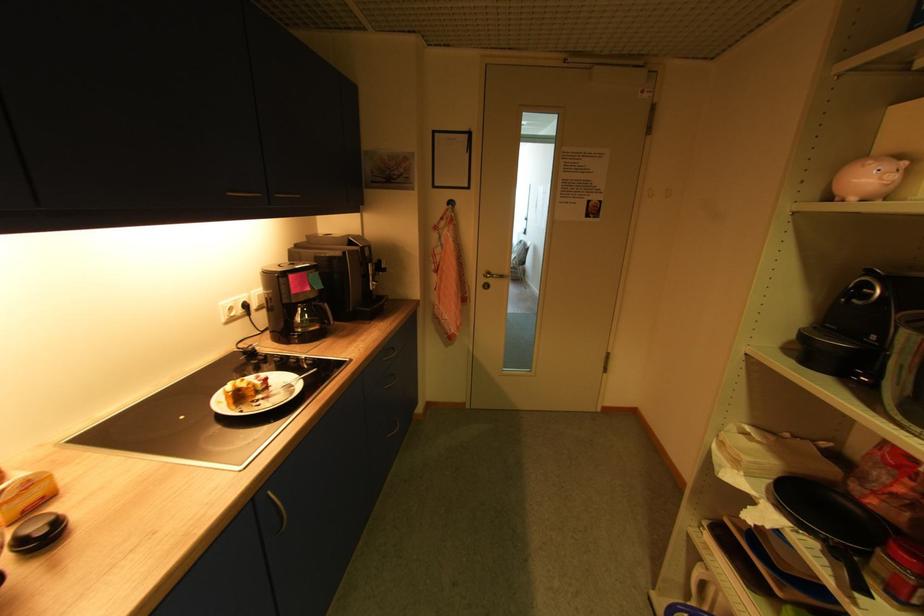
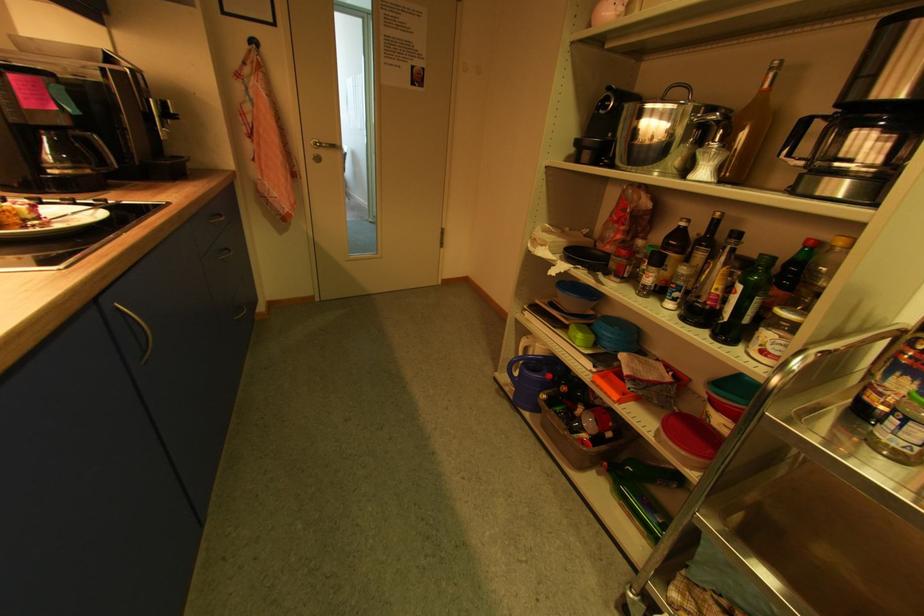
Find the pixel in the second image that matches (494,275) in the first image.

(323, 146)